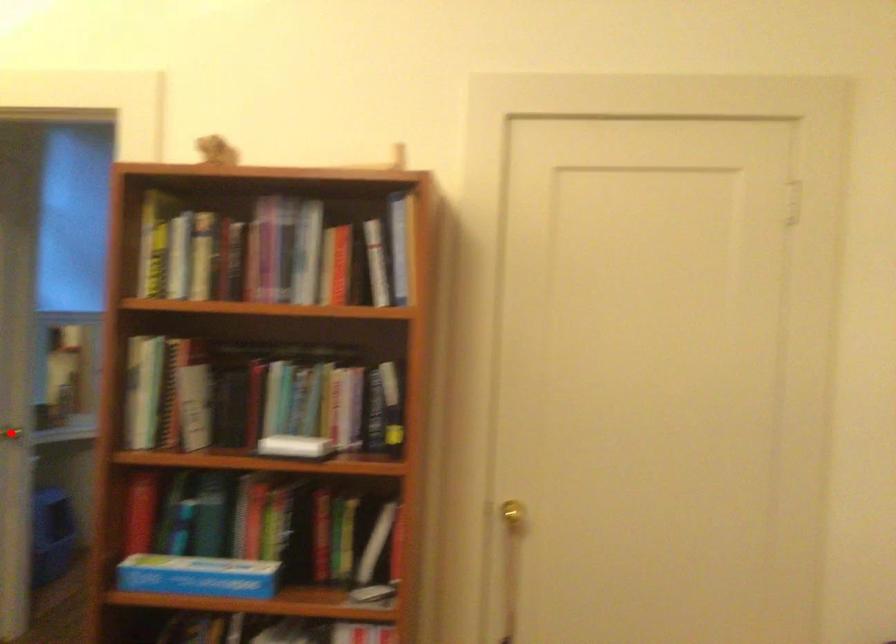
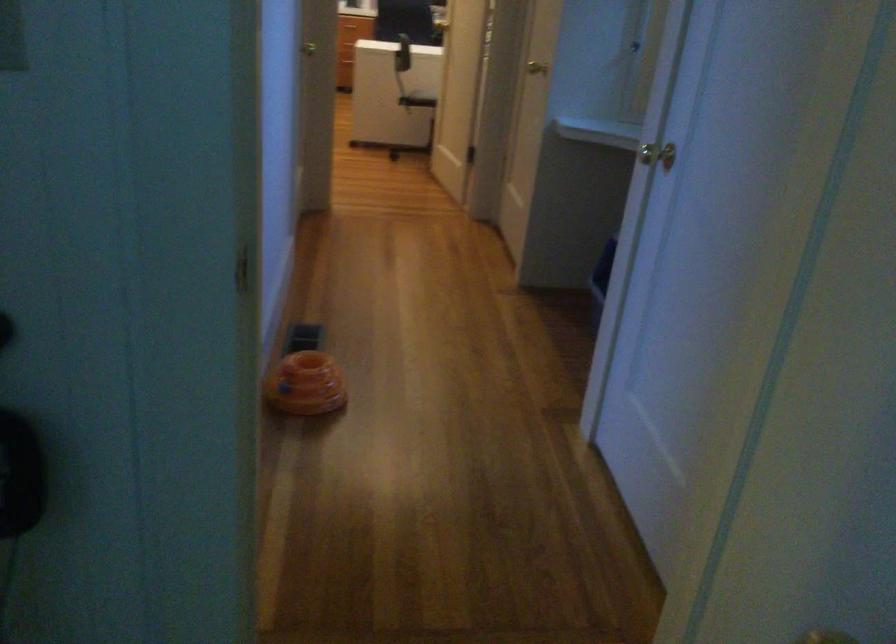
Question: I am providing you with two images of the same scene from different viewpoints. A red point is marked on the first image. Can you still see the location of the red point in image 2?

Choices:
 (A) Yes
 (B) No

Answer: (B)